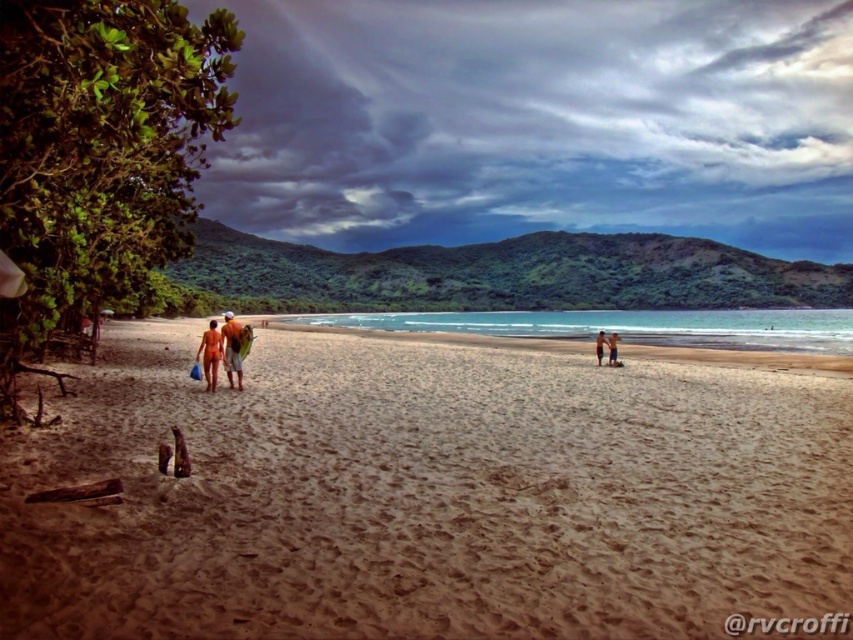
Is point (236, 387) positioned in front of point (601, 339)?

Yes.

Is orange fabric shorts at center to the left of smooth tan skin at center from the viewer's perspective?

Yes, orange fabric shorts at center is to the left of smooth tan skin at center.

Is point (230, 321) positioned behind point (596, 337)?

No, it is in front of (596, 337).

Where is `orange fabric shorts at center`? Image resolution: width=853 pixels, height=640 pixels. orange fabric shorts at center is located at coordinates (231, 349).

Who is higher up, brown sandy beach at center or orange matte surfboard at center?

orange matte surfboard at center

Can you confirm if brown sandy beach at center is smaller than orange matte surfboard at center?

No, brown sandy beach at center is not smaller than orange matte surfboard at center.

You are a GUI agent. You are given a task and a screenshot of the screen. Output one action in this format:
    pyautogui.click(x=<x>, y=<y>)
    Task: Click on the brown sandy beach at center
    
    Given the screenshot: What is the action you would take?
    pyautogui.click(x=428, y=496)

I want to click on brown sandy beach at center, so click(x=428, y=496).

Is orange matte surfboard at center closer to the viewer compared to tan skin couple at center?

Yes, it is in front of tan skin couple at center.

Can you confirm if orange matte surfboard at center is positioned to the left of tan skin couple at center?

Correct, you'll find orange matte surfboard at center to the left of tan skin couple at center.

What do you see at coordinates (224, 349) in the screenshot? I see `orange matte surfboard at center` at bounding box center [224, 349].

This screenshot has width=853, height=640. I want to click on orange matte surfboard at center, so click(224, 349).